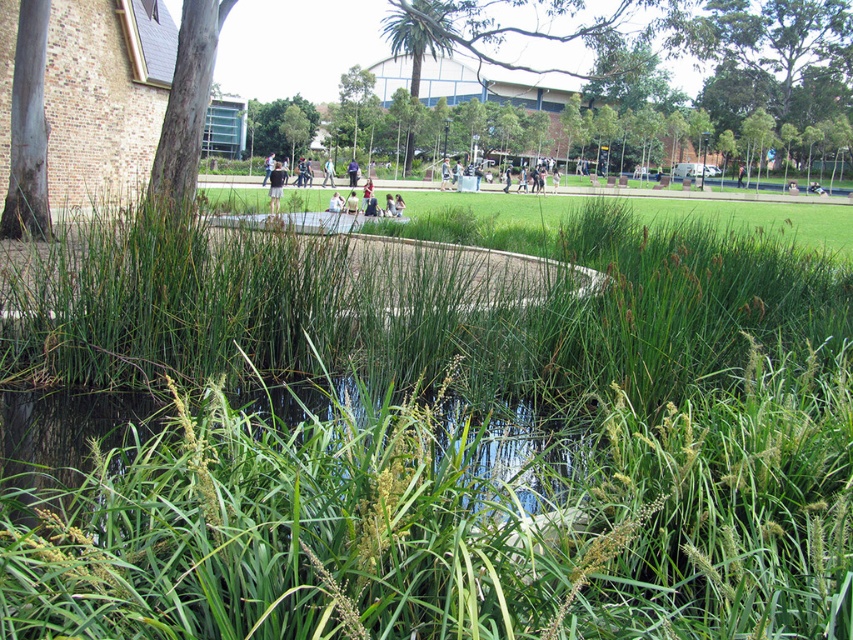
Question: Can you confirm if light blue jeans at center is wider than light brown leather jacket at center?

Choices:
 (A) no
 (B) yes

Answer: (B)

Question: Which object appears closest to the camera in this image?

Choices:
 (A) dark blue fabric at center
 (B) green grass at center
 (C) light brown leather jacket at center
 (D) dark blue jeans at center

Answer: (B)

Question: Can you confirm if dark blue jeans at center is wider than light blue jeans at center?

Choices:
 (A) no
 (B) yes

Answer: (B)

Question: Can you confirm if light blue jeans at center is positioned above dark blue fabric at center?

Choices:
 (A) no
 (B) yes

Answer: (B)

Question: Which of the following is the closest to the observer?

Choices:
 (A) (492, 160)
 (B) (329, 164)
 (C) (354, 173)
 (D) (219, 28)

Answer: (D)

Question: Which point appears closest to the camera in this image?

Choices:
 (A) (351, 172)
 (B) (572, 202)
 (C) (338, 209)
 (D) (476, 164)

Answer: (C)